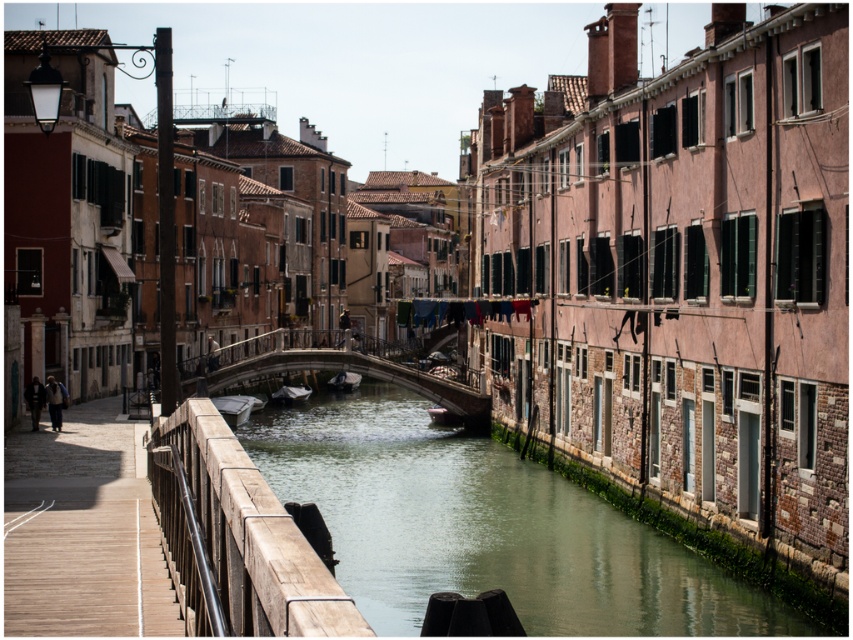
You are standing on the wooden bridge in the canal scene. You see two points marked in the image. Which point, point (282, 548) or point (339, 387), is closer to you?

Point (282, 548) is closer to the viewer than point (339, 387).

You are a tourist standing at the wooden rail at lower left, looking across the canal. You notice the white matte boat at center. Which object is larger in size?

The wooden rail at lower left is bigger than the white matte boat at center.

You are standing on the wooden rail at lower left and want to see the white matte boat at center. Which direction should you look to see it?

The wooden rail at lower left is above the white matte boat at center, so you should look downward to see it.